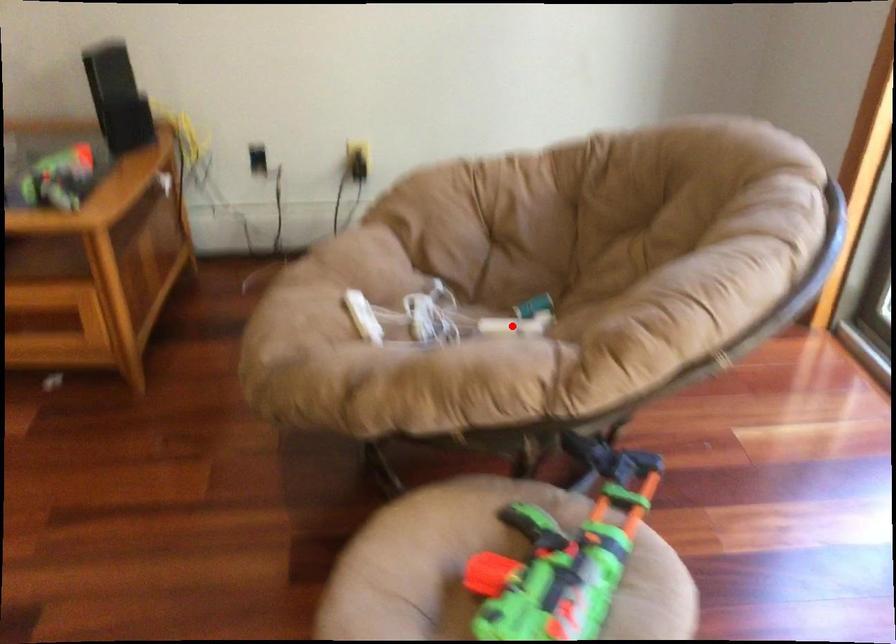
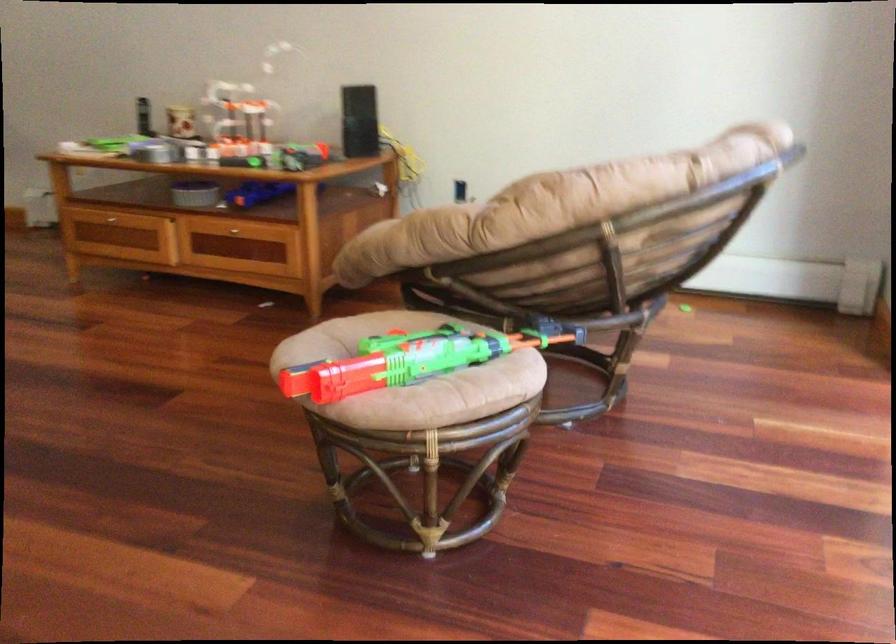
Question: I am providing you with two images of the same scene from different viewpoints. A red point is marked on the first image. Is the red point's position out of view in image 2?

Choices:
 (A) Yes
 (B) No

Answer: (A)